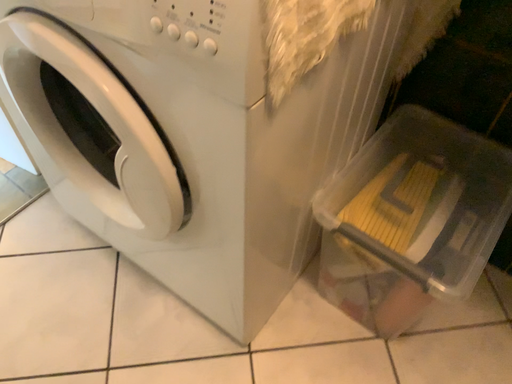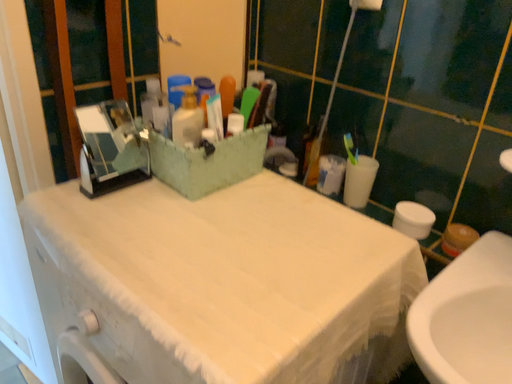
Question: How did the camera likely rotate when shooting the video?

Choices:
 (A) rotated upward
 (B) rotated downward

Answer: (A)